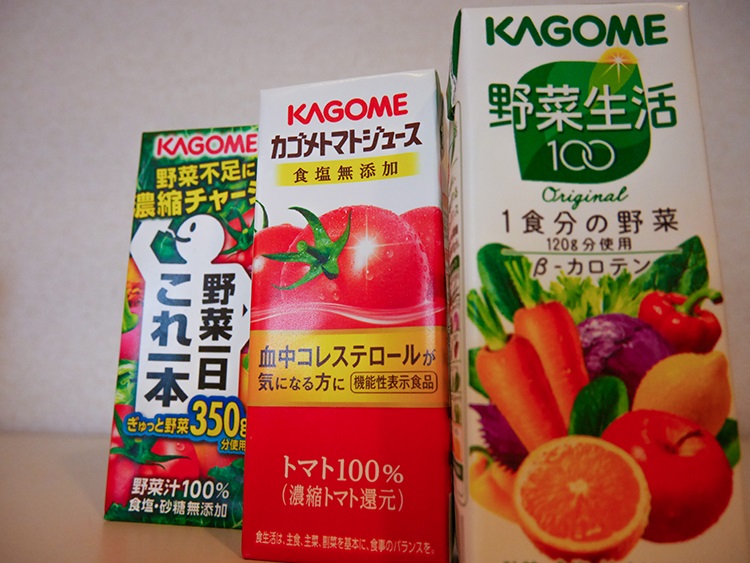
Identify the location of corner. The width and height of the screenshot is (750, 563). (58, 433).